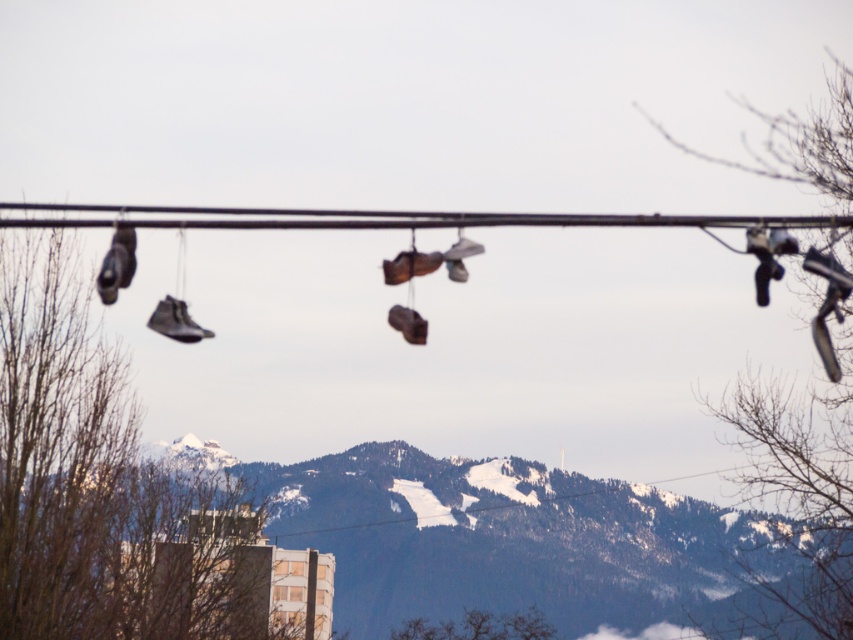
Is matte black shoe at left positioned before matte black sneaker at center?

Yes, matte black shoe at left is in front of matte black sneaker at center.

Is point (115, 260) behind point (178, 312)?

No, (115, 260) is closer to viewer.

Where is `matte black shoe at left`? The width and height of the screenshot is (853, 640). matte black shoe at left is located at coordinates (117, 264).

In the scene shown: Can you confirm if snowy forested mountain at center is shorter than matte black sneaker at center?

No, snowy forested mountain at center is not shorter than matte black sneaker at center.

Can you confirm if snowy forested mountain at center is positioned to the right of matte black sneaker at center?

Indeed, snowy forested mountain at center is positioned on the right side of matte black sneaker at center.

Image resolution: width=853 pixels, height=640 pixels. In order to click on snowy forested mountain at center in this screenshot , I will do `click(456, 541)`.

You are a GUI agent. You are given a task and a screenshot of the screen. Output one action in this format:
    pyautogui.click(x=<x>, y=<y>)
    Task: Click on the snowy forested mountain at center
    The image size is (853, 640).
    Given the screenshot: What is the action you would take?
    pyautogui.click(x=456, y=541)

Who is positioned more to the left, snowy forested mountain at center or matte black shoe at left?

Positioned to the left is matte black shoe at left.

Is snowy forested mountain at center bigger than matte black shoe at left?

Yes, snowy forested mountain at center is bigger than matte black shoe at left.

Image resolution: width=853 pixels, height=640 pixels. In order to click on snowy forested mountain at center in this screenshot , I will do `click(456, 541)`.

Find the location of a particular element. The width and height of the screenshot is (853, 640). snowy forested mountain at center is located at coordinates (456, 541).